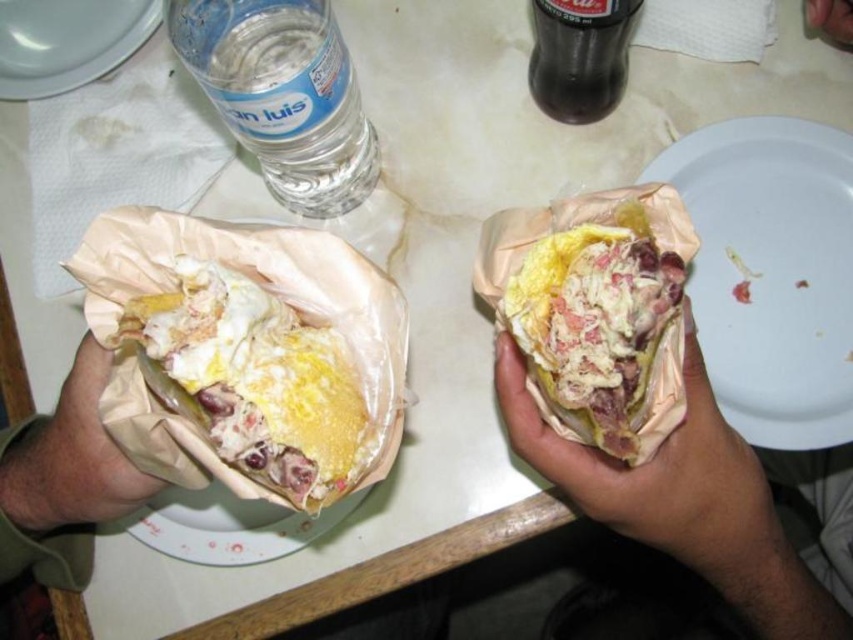
Question: Is yellowish matte sandwich at center positioned in front of white glossy plate at upper left?

Choices:
 (A) no
 (B) yes

Answer: (B)

Question: Is yellowish paper at center to the left of white glossy plate at upper left from the viewer's perspective?

Choices:
 (A) yes
 (B) no

Answer: (B)

Question: Which point is closer to the camera?

Choices:
 (A) (151, 301)
 (B) (77, 74)
 (C) (846, 436)
 (D) (579, 112)

Answer: (A)

Question: Among these objects, which one is farthest from the camera?

Choices:
 (A) white matte plate at right
 (B) clear plastic bottle at upper left
 (C) white paper plate at lower left

Answer: (C)

Question: Estimate the real-world distances between objects in this image. Which object is farther from the yellowish paper-wrapped sandwich at left?

Choices:
 (A) dark glass bottle at upper center
 (B) yellowish paper at center

Answer: (A)

Question: Is white matte plate at right positioned at the back of clear plastic bottle at upper left?

Choices:
 (A) yes
 (B) no

Answer: (A)